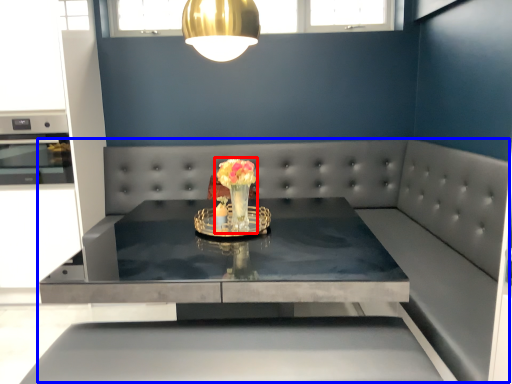
Question: Among these objects, which one is nearest to the camera, floral arrangement (highlighted by a red box) or couch (highlighted by a blue box)?

Choices:
 (A) floral arrangement
 (B) couch

Answer: (B)